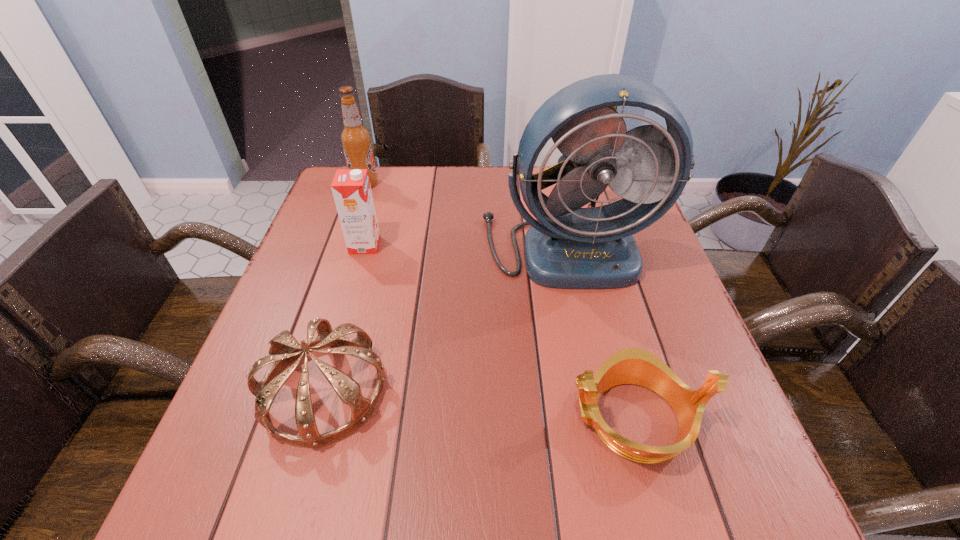
Find the location of a particular element. This screenshot has width=960, height=540. fan is located at coordinates (568, 247).

This screenshot has height=540, width=960. What are the coordinates of `beer bottle` in the screenshot? It's located at [x=356, y=140].

Where is `the fourth shortest object`? The width and height of the screenshot is (960, 540). the fourth shortest object is located at coordinates (356, 140).

In order to click on carton in this screenshot , I will do `click(351, 189)`.

You are a GUI agent. You are given a task and a screenshot of the screen. Output one action in this format:
    pyautogui.click(x=<x>, y=<y>)
    Task: Click on the left tiara
    This screenshot has width=960, height=540.
    Given the screenshot: What is the action you would take?
    pyautogui.click(x=284, y=349)

The width and height of the screenshot is (960, 540). I want to click on the right tiara, so click(x=636, y=366).

This screenshot has height=540, width=960. I want to click on free space located in front of the tallest object to blow air, so click(x=601, y=400).

The height and width of the screenshot is (540, 960). What are the coordinates of `vacant area situated 0.070m on the front label of the fourth shortest object` in the screenshot? It's located at (402, 184).

The height and width of the screenshot is (540, 960). In order to click on free spot located on the front of the carton in this screenshot , I will do `click(351, 292)`.

At what (x,y) coordinates should I click in order to perform the action: click on vacant space situated on the back of the left tiara. Please return your answer as a coordinate pair (x, y). Looking at the image, I should click on (364, 253).